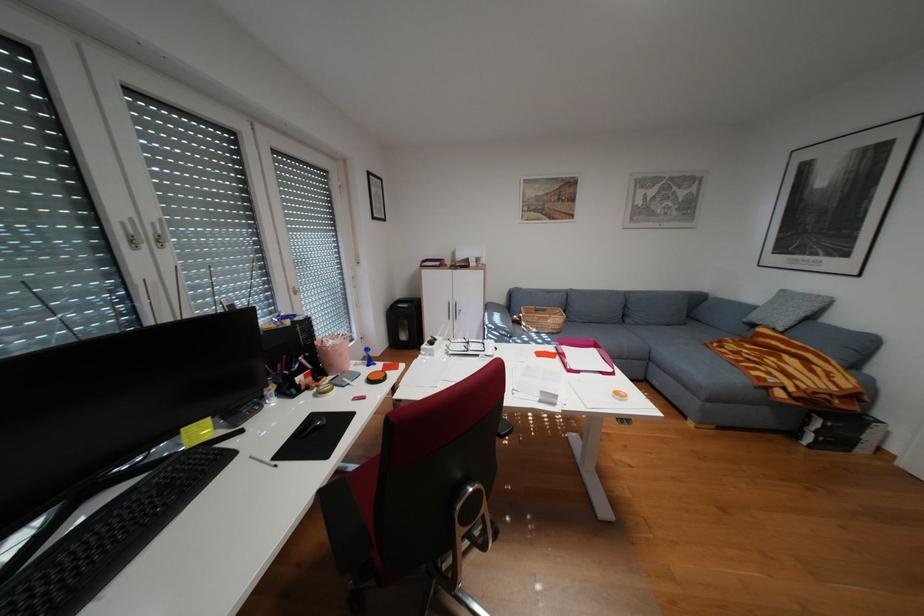
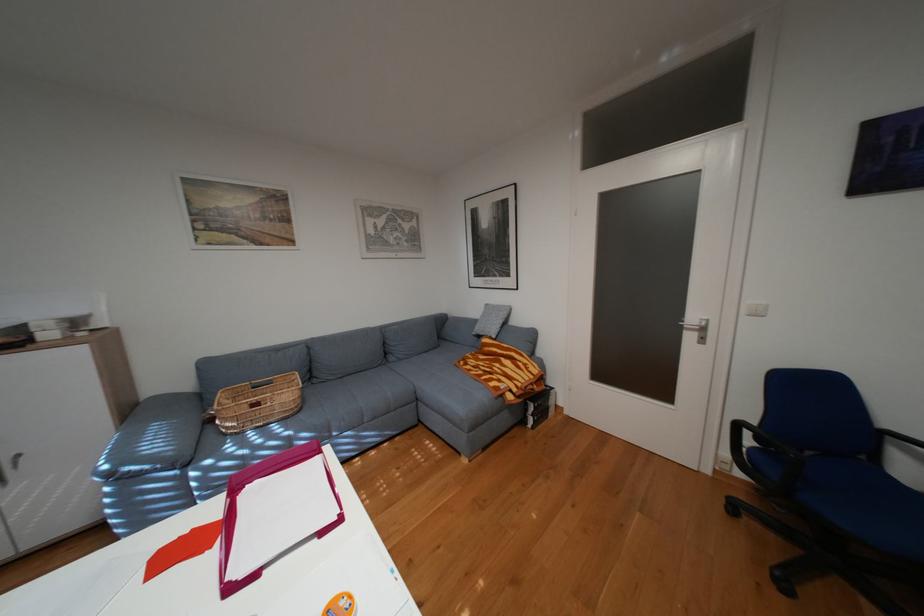
Question: The camera is either moving clockwise (left) or counter-clockwise (right) around the object. The first image is from the beginning of the video and the second image is from the end. Is the camera moving left or right when shooting the video?

Choices:
 (A) Left
 (B) Right

Answer: (A)